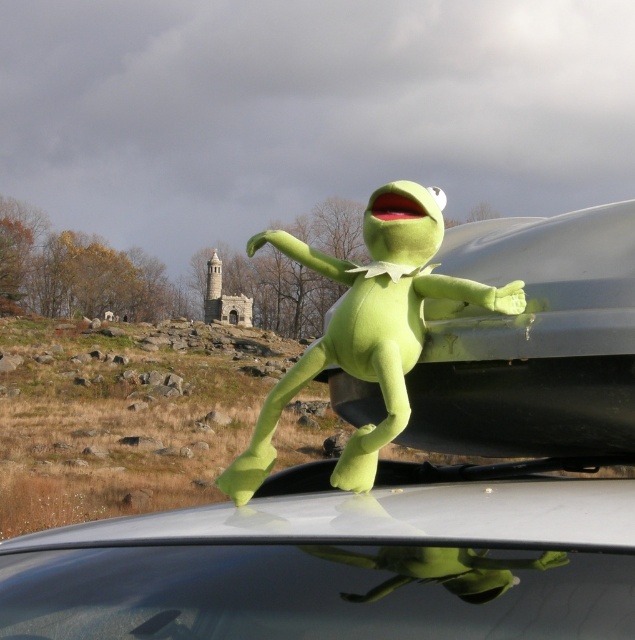
In the scene shown: Is metallic gray car at center positioned in front of green plush toy at center?

Yes, metallic gray car at center is in front of green plush toy at center.

Which is in front, point (97, 538) or point (364, 348)?

Point (97, 538) is more forward.

Where is `metallic gray car at center`? The height and width of the screenshot is (640, 635). metallic gray car at center is located at coordinates (408, 486).